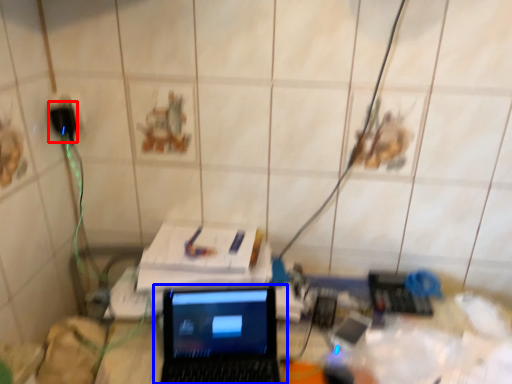
Question: Which object is closer to the camera taking this photo, plug (highlighted by a red box) or laptop (highlighted by a blue box)?

Choices:
 (A) plug
 (B) laptop

Answer: (B)